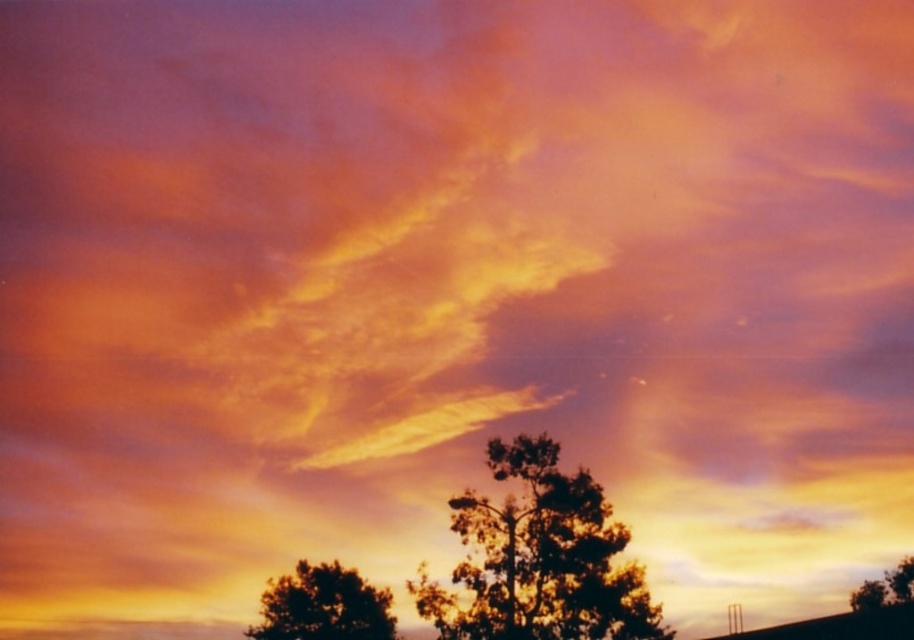
Question: Does silhouette leafy tree at lower center appear on the left side of silhouette leafy tree at lower right?

Choices:
 (A) no
 (B) yes

Answer: (B)

Question: Among these objects, which one is nearest to the camera?

Choices:
 (A) silhouette leafy tree at lower right
 (B) silhouette leafy tree at lower center
 (C) silhouette leafy tree at center

Answer: (C)

Question: Where is silhouette leafy tree at lower center located in relation to silhouette leafy tree at lower right in the image?

Choices:
 (A) below
 (B) above

Answer: (B)

Question: Is silhouette leafy tree at lower center above silhouette leafy tree at lower right?

Choices:
 (A) no
 (B) yes

Answer: (B)

Question: Which object is the farthest from the silhouette leafy tree at center?

Choices:
 (A) silhouette leafy tree at lower right
 (B) silhouette leafy tree at lower center

Answer: (A)

Question: Which point is closer to the camera?

Choices:
 (A) silhouette leafy tree at center
 (B) silhouette leafy tree at lower right
 (C) silhouette leafy tree at lower center

Answer: (A)